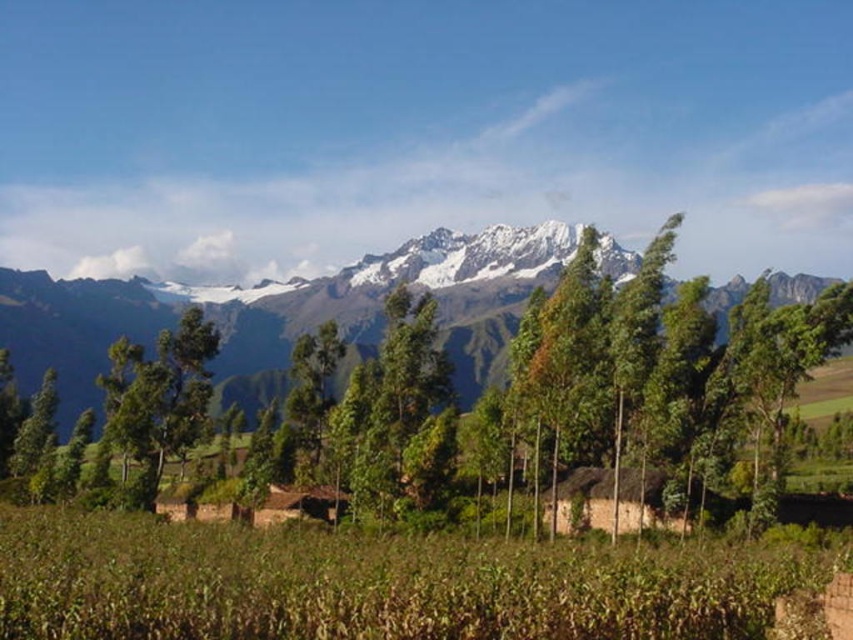
You are standing at the origin of the coordinate system in the rural landscape. You see two points marked in the image. Which point is closer to you, point [230,328] or point [149,364]?

Point [149,364] is closer to you because the description states that point [230,328] is behind point [149,364].

You are a hiker standing in the middle of the green field. You want to take a photo that includes both the snowy rock mountain range at upper center and the green leafy tree at center. Which object should you position closer to the edge of the frame to ensure both are fully visible?

You should position the green leafy tree at center closer to the edge of the frame because the snowy rock mountain range at upper center is taller and needs more vertical space to be fully visible.